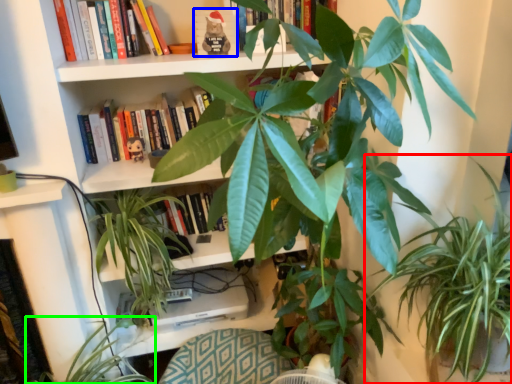
Question: Based on their relative distances, which object is farther from houseplant (highlighted by a red box)? Choose from paperback book (highlighted by a blue box) and houseplant (highlighted by a green box).

Choices:
 (A) paperback book
 (B) houseplant

Answer: (B)